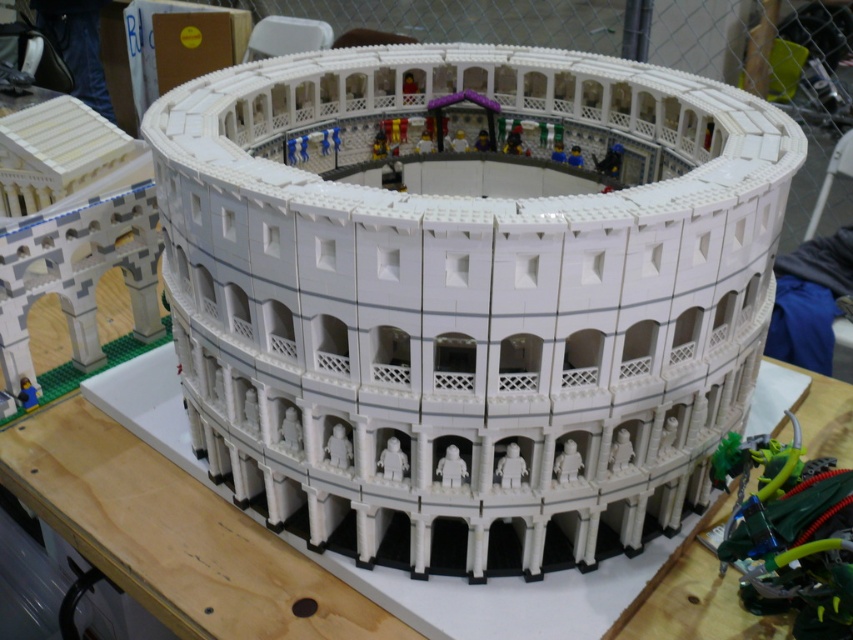
You are a LEGO enthusiast who wants to place a new miniature statue on the wooden table at center. However, you need to ensure that the statue won not block the view of the white lego colosseum at center. Given their sizes, is this possible?

The white lego colosseum at center is larger in size than wooden table at center, so placing a statue on the wooden table at center might block the view of the white lego colosseum at center depending on the statue size. However, since the table is smaller, you could position the statue carefully to avoid blocking the view.

You are a LEGO enthusiast who wants to display the white lego colosseum at center on the wooden table at center. Can you place the colosseum on the table without it falling over?

The white lego colosseum at center is much taller than the wooden table at center, so it may not be stable and could fall over if placed on the table.

You are a guest at a LEGO exhibition and notice the white lego colosseum at center and the wooden table at center. Which object is closer to you as you face the display?

The white lego colosseum at center is closer to you because it is positioned in front of the wooden table at center.